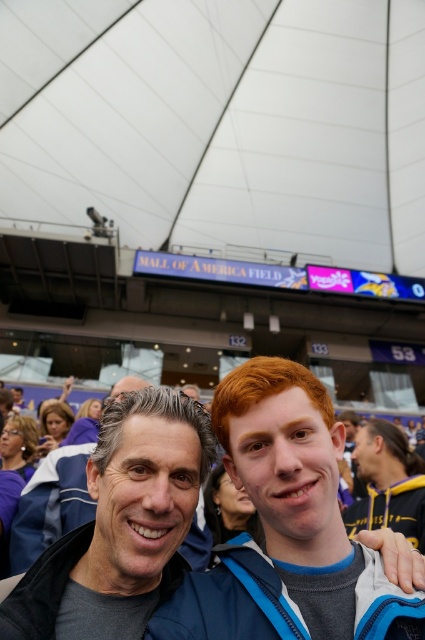
You are a photographer standing at the edge of the field. You want to take a photo that includes both the matte blue jacket at center and the dark blue jacket at center. The camera you are using has a focal length of 50mm. Considering the distance between them, is the separation between the two jackets within the camera lens field of view at this focal length?

The distance between the matte blue jacket at center and the dark blue jacket at center is 4.60 feet. At a 50mm focal length, the field of view typically allows capturing subjects within this distance comfortably, so yes, the separation is within the field of view.

You are trying to decide which jacket to wear to a casual event. Both jackets are available in the same size. The matte blue jacket at center and the dark blue jacket at center are both options. Which jacket would you choose if you want the one that appears wider?

The matte blue jacket at center is wider than the dark blue jacket at center, so you should choose the matte blue jacket at center.